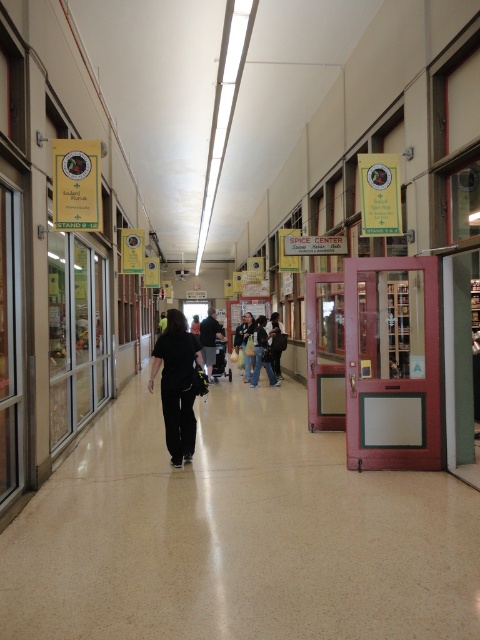
Can you confirm if brown speckled tile floor at center is positioned below black matte pants at center?

Indeed, brown speckled tile floor at center is positioned under black matte pants at center.

From the picture: Who is positioned more to the right, brown speckled tile floor at center or black matte pants at center?

brown speckled tile floor at center is more to the right.

What do you see at coordinates (237, 532) in the screenshot? I see `brown speckled tile floor at center` at bounding box center [237, 532].

The image size is (480, 640). I want to click on brown speckled tile floor at center, so click(x=237, y=532).